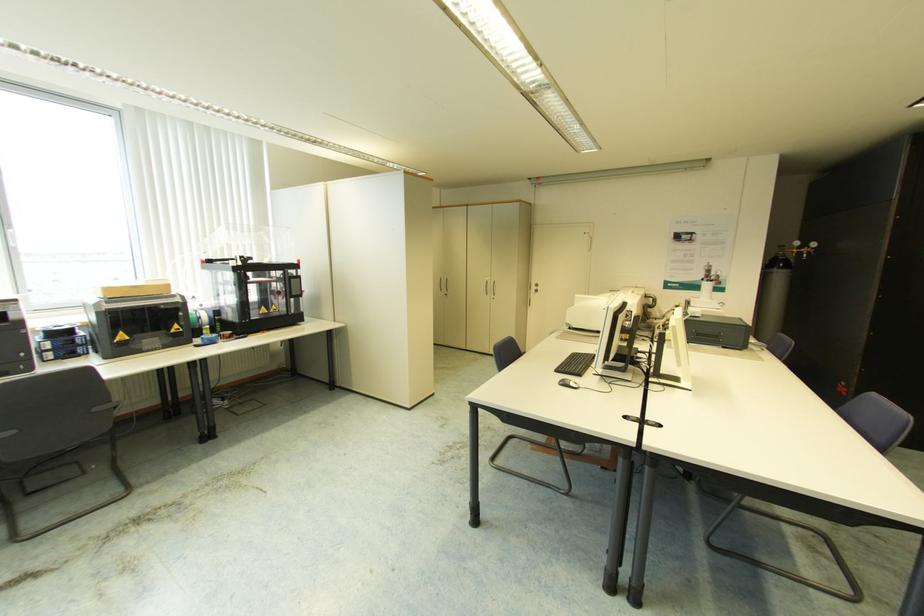
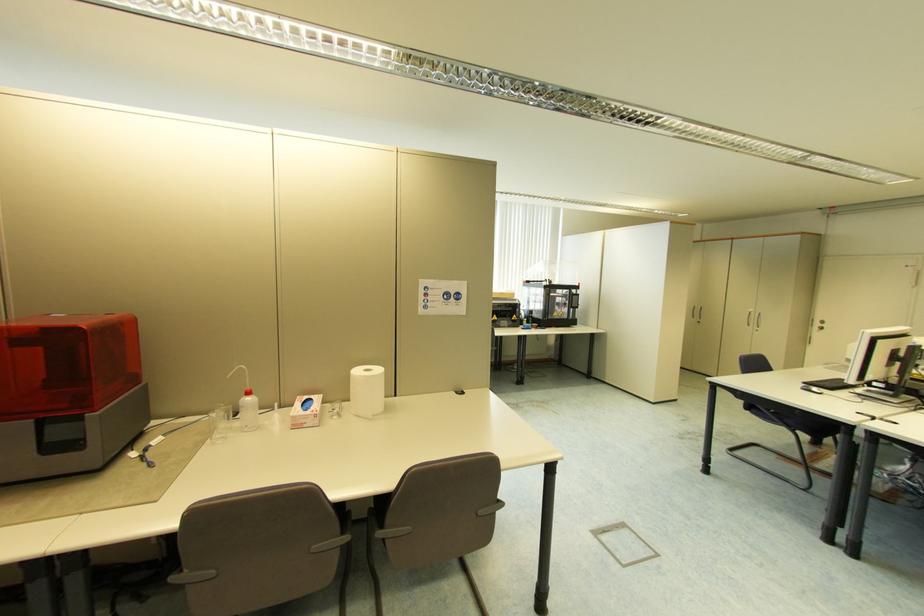
In the second image, find the point that corresponds to point (604, 377) in the first image.

(862, 394)